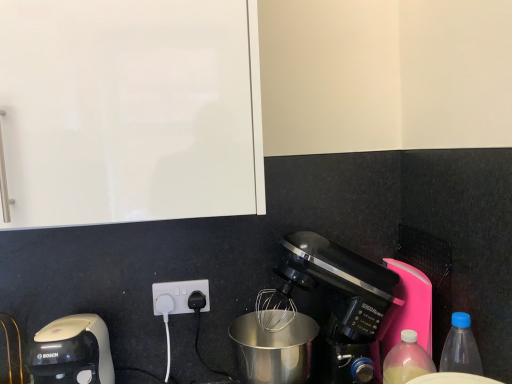
You are a GUI agent. You are given a task and a screenshot of the screen. Output one action in this format:
    pyautogui.click(x=<x>, y=<y>)
    Task: Click on the translucent plastic bottle at lower right, the 1th bottle when ordered from left to right
    The width and height of the screenshot is (512, 384).
    Given the screenshot: What is the action you would take?
    pyautogui.click(x=406, y=360)

From the image's perspective, is black plastic power plugs and sockets at lower center on translucent plastic bottle at lower right, the second bottle from the right?

Correct, black plastic power plugs and sockets at lower center appears higher than translucent plastic bottle at lower right, the second bottle from the right, in the image.

From a real-world perspective, which is physically below, black plastic power plugs and sockets at lower center or translucent plastic bottle at lower right, the second bottle from the right?

translucent plastic bottle at lower right, the second bottle from the right.

Between black plastic power plugs and sockets at lower center and translucent plastic bottle at lower right, the 1th bottle when ordered from left to right, which one has more height?

With more height is translucent plastic bottle at lower right, the 1th bottle when ordered from left to right.

Looking at this image, does white plastic coffee maker at lower left, the first coffee maker positioned from the left, have a greater width compared to matte black coffee maker at lower right, which ranks as the 1th coffee maker in right-to-left order?

Correct, the width of white plastic coffee maker at lower left, the first coffee maker positioned from the left, exceeds that of matte black coffee maker at lower right, which ranks as the 1th coffee maker in right-to-left order.

Does white plastic coffee maker at lower left, the first coffee maker positioned from the left, have a greater height compared to matte black coffee maker at lower right, which ranks as the 1th coffee maker in right-to-left order?

No, white plastic coffee maker at lower left, the first coffee maker positioned from the left, is not taller than matte black coffee maker at lower right, which ranks as the 1th coffee maker in right-to-left order.

Consider the image. From the image's perspective, is white plastic coffee maker at lower left, marked as the 2th coffee maker in a right-to-left arrangement, beneath matte black coffee maker at lower right, the second coffee maker viewed from the left?

Yes.

I want to click on coffee maker located behind the white plastic coffee maker at lower left, the first coffee maker positioned from the left, so click(342, 300).

Considering their positions, is blue translucent bottle at lower right, which is counted as the 1th bottle, starting from the right, located in front of or behind matte black coffee maker at lower right, which ranks as the 1th coffee maker in right-to-left order?

blue translucent bottle at lower right, which is counted as the 1th bottle, starting from the right, is positioned closer to the viewer than matte black coffee maker at lower right, which ranks as the 1th coffee maker in right-to-left order.

Considering the sizes of objects blue translucent bottle at lower right, which is counted as the 1th bottle, starting from the right, and matte black coffee maker at lower right, which ranks as the 1th coffee maker in right-to-left order, in the image provided, who is smaller, blue translucent bottle at lower right, which is counted as the 1th bottle, starting from the right, or matte black coffee maker at lower right, which ranks as the 1th coffee maker in right-to-left order,?

blue translucent bottle at lower right, which is counted as the 1th bottle, starting from the right.

In the scene shown: Considering the positions of objects blue translucent bottle at lower right, which is the 2th bottle in left-to-right order, and matte black coffee maker at lower right, which ranks as the 1th coffee maker in right-to-left order, in the image provided, who is more to the right, blue translucent bottle at lower right, which is the 2th bottle in left-to-right order, or matte black coffee maker at lower right, which ranks as the 1th coffee maker in right-to-left order,?

blue translucent bottle at lower right, which is the 2th bottle in left-to-right order.

Considering the relative sizes of blue translucent bottle at lower right, which is the 2th bottle in left-to-right order, and matte black coffee maker at lower right, which ranks as the 1th coffee maker in right-to-left order, in the image provided, is blue translucent bottle at lower right, which is the 2th bottle in left-to-right order, wider than matte black coffee maker at lower right, which ranks as the 1th coffee maker in right-to-left order,?

No.

Is black plastic power plugs and sockets at lower center placed right next to white plastic coffee maker at lower left, the first coffee maker positioned from the left?

No, black plastic power plugs and sockets at lower center is not in contact with white plastic coffee maker at lower left, the first coffee maker positioned from the left.

From the image's perspective, between black plastic power plugs and sockets at lower center and white plastic coffee maker at lower left, the first coffee maker positioned from the left, who is located below?

From the image's view, white plastic coffee maker at lower left, the first coffee maker positioned from the left, is below.

Measure the distance between black plastic power plugs and sockets at lower center and white plastic coffee maker at lower left, marked as the 2th coffee maker in a right-to-left arrangement.

A distance of 8.95 inches exists between black plastic power plugs and sockets at lower center and white plastic coffee maker at lower left, marked as the 2th coffee maker in a right-to-left arrangement.

Can we say black plastic power plugs and sockets at lower center lies outside white plastic coffee maker at lower left, the first coffee maker positioned from the left?

black plastic power plugs and sockets at lower center is positioned outside white plastic coffee maker at lower left, the first coffee maker positioned from the left.

Does blue translucent bottle at lower right, which is counted as the 1th bottle, starting from the right, appear on the right side of translucent plastic bottle at lower right, the second bottle from the right?

Indeed, blue translucent bottle at lower right, which is counted as the 1th bottle, starting from the right, is positioned on the right side of translucent plastic bottle at lower right, the second bottle from the right.

Which point is more forward, (453, 336) or (399, 348)?

Positioned in front is point (453, 336).

Who is more distant, blue translucent bottle at lower right, which is counted as the 1th bottle, starting from the right, or translucent plastic bottle at lower right, the 1th bottle when ordered from left to right?

Positioned behind is translucent plastic bottle at lower right, the 1th bottle when ordered from left to right.

From the image's perspective, is translucent plastic bottle at lower right, the 1th bottle when ordered from left to right, located above blue translucent bottle at lower right, which is the 2th bottle in left-to-right order?

Actually, translucent plastic bottle at lower right, the 1th bottle when ordered from left to right, appears below blue translucent bottle at lower right, which is the 2th bottle in left-to-right order, in the image.

Considering the relative positions of translucent plastic bottle at lower right, the 1th bottle when ordered from left to right, and blue translucent bottle at lower right, which is counted as the 1th bottle, starting from the right, in the image provided, is translucent plastic bottle at lower right, the 1th bottle when ordered from left to right, to the left of blue translucent bottle at lower right, which is counted as the 1th bottle, starting from the right, from the viewer's perspective?

Yes.

Considering the relative sizes of translucent plastic bottle at lower right, the second bottle from the right, and blue translucent bottle at lower right, which is the 2th bottle in left-to-right order, in the image provided, is translucent plastic bottle at lower right, the second bottle from the right, smaller than blue translucent bottle at lower right, which is the 2th bottle in left-to-right order,?

No, translucent plastic bottle at lower right, the second bottle from the right, is not smaller than blue translucent bottle at lower right, which is the 2th bottle in left-to-right order.

From a real-world perspective, is white plastic coffee maker at lower left, marked as the 2th coffee maker in a right-to-left arrangement, physically above blue translucent bottle at lower right, which is counted as the 1th bottle, starting from the right?

Incorrect, from a real-world perspective, white plastic coffee maker at lower left, marked as the 2th coffee maker in a right-to-left arrangement, is lower than blue translucent bottle at lower right, which is counted as the 1th bottle, starting from the right.

Is white plastic coffee maker at lower left, the first coffee maker positioned from the left, smaller than blue translucent bottle at lower right, which is counted as the 1th bottle, starting from the right?

No, white plastic coffee maker at lower left, the first coffee maker positioned from the left, is not smaller than blue translucent bottle at lower right, which is counted as the 1th bottle, starting from the right.

Can you confirm if white plastic coffee maker at lower left, the first coffee maker positioned from the left, is shorter than blue translucent bottle at lower right, which is counted as the 1th bottle, starting from the right?

Yes, white plastic coffee maker at lower left, the first coffee maker positioned from the left, is shorter than blue translucent bottle at lower right, which is counted as the 1th bottle, starting from the right.

Is white plastic coffee maker at lower left, the first coffee maker positioned from the left, looking in the opposite direction of blue translucent bottle at lower right, which is counted as the 1th bottle, starting from the right?

white plastic coffee maker at lower left, the first coffee maker positioned from the left, does not have its back to blue translucent bottle at lower right, which is counted as the 1th bottle, starting from the right.

From the image's perspective, starting from the black plastic power plugs and sockets at lower center, which bottle is the 2nd one below? Please provide its 2D coordinates.

[(406, 360)]

Locate an element on the screen. The width and height of the screenshot is (512, 384). coffee maker below the matte black coffee maker at lower right, which ranks as the 1th coffee maker in right-to-left order (from a real-world perspective) is located at coordinates [x=72, y=352].

Consider the image. Estimate the real-world distances between objects in this image. Which object is further from translucent plastic bottle at lower right, the 1th bottle when ordered from left to right, black plastic power plugs and sockets at lower center or matte black coffee maker at lower right, the second coffee maker viewed from the left?

black plastic power plugs and sockets at lower center lies further to translucent plastic bottle at lower right, the 1th bottle when ordered from left to right, than the other object.

Consider the image. When comparing their distances from translucent plastic bottle at lower right, the second bottle from the right, does matte black coffee maker at lower right, which ranks as the 1th coffee maker in right-to-left order, or black plastic power plugs and sockets at lower center seem further?

The object further to translucent plastic bottle at lower right, the second bottle from the right, is black plastic power plugs and sockets at lower center.

Which object lies further to the anchor point translucent plastic bottle at lower right, the second bottle from the right, black plastic power plugs and sockets at lower center or white plastic coffee maker at lower left, the first coffee maker positioned from the left?

white plastic coffee maker at lower left, the first coffee maker positioned from the left.

In the scene shown: When comparing their distances from translucent plastic bottle at lower right, the 1th bottle when ordered from left to right, does matte black coffee maker at lower right, which ranks as the 1th coffee maker in right-to-left order, or white plastic coffee maker at lower left, marked as the 2th coffee maker in a right-to-left arrangement, seem closer?

The object closer to translucent plastic bottle at lower right, the 1th bottle when ordered from left to right, is matte black coffee maker at lower right, which ranks as the 1th coffee maker in right-to-left order.

Based on the photo, based on their spatial positions, is blue translucent bottle at lower right, which is counted as the 1th bottle, starting from the right, or translucent plastic bottle at lower right, the 1th bottle when ordered from left to right, closer to white plastic coffee maker at lower left, marked as the 2th coffee maker in a right-to-left arrangement?

translucent plastic bottle at lower right, the 1th bottle when ordered from left to right, is closer to white plastic coffee maker at lower left, marked as the 2th coffee maker in a right-to-left arrangement.

Consider the image. From the image, which object appears to be farther from white plastic coffee maker at lower left, marked as the 2th coffee maker in a right-to-left arrangement, matte black coffee maker at lower right, which ranks as the 1th coffee maker in right-to-left order, or blue translucent bottle at lower right, which is counted as the 1th bottle, starting from the right?

blue translucent bottle at lower right, which is counted as the 1th bottle, starting from the right.

Looking at the image, which one is located further to black plastic power plugs and sockets at lower center, blue translucent bottle at lower right, which is counted as the 1th bottle, starting from the right, or white plastic coffee maker at lower left, marked as the 2th coffee maker in a right-to-left arrangement?

blue translucent bottle at lower right, which is counted as the 1th bottle, starting from the right.

Considering their positions, is translucent plastic bottle at lower right, the second bottle from the right, positioned further to matte black coffee maker at lower right, the second coffee maker viewed from the left, than blue translucent bottle at lower right, which is counted as the 1th bottle, starting from the right?

blue translucent bottle at lower right, which is counted as the 1th bottle, starting from the right, lies further to matte black coffee maker at lower right, the second coffee maker viewed from the left, than the other object.

Where is `power plugs and sockets situated between white plastic coffee maker at lower left, the first coffee maker positioned from the left, and blue translucent bottle at lower right, which is counted as the 1th bottle, starting from the right, from left to right`? The image size is (512, 384). power plugs and sockets situated between white plastic coffee maker at lower left, the first coffee maker positioned from the left, and blue translucent bottle at lower right, which is counted as the 1th bottle, starting from the right, from left to right is located at coordinates (181, 294).

You are a GUI agent. You are given a task and a screenshot of the screen. Output one action in this format:
    pyautogui.click(x=<x>, y=<y>)
    Task: Click on the coffee maker situated between black plastic power plugs and sockets at lower center and blue translucent bottle at lower right, which is the 2th bottle in left-to-right order, from left to right
    The width and height of the screenshot is (512, 384).
    Given the screenshot: What is the action you would take?
    pyautogui.click(x=342, y=300)

Where is `coffee maker between black plastic power plugs and sockets at lower center and translucent plastic bottle at lower right, the second bottle from the right, in the horizontal direction`? Image resolution: width=512 pixels, height=384 pixels. coffee maker between black plastic power plugs and sockets at lower center and translucent plastic bottle at lower right, the second bottle from the right, in the horizontal direction is located at coordinates (342, 300).

I want to click on coffee maker between white plastic coffee maker at lower left, the first coffee maker positioned from the left, and blue translucent bottle at lower right, which is counted as the 1th bottle, starting from the right, in the horizontal direction, so click(x=342, y=300).